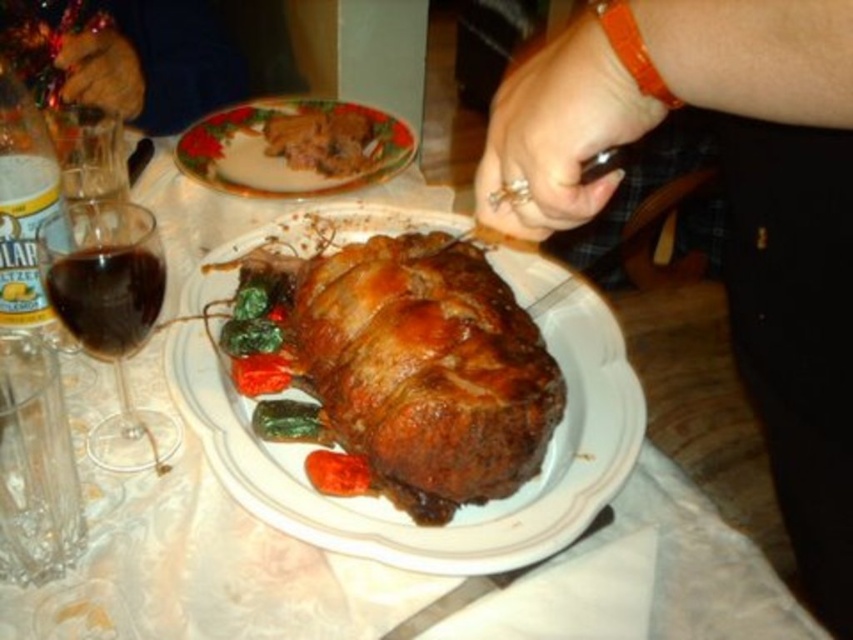
You are a guest at a dinner table and want to reach for the transparent glass at left without touching the smooth brown ham at center. Is this possible given their positions?

The smooth brown ham at center is positioned under the transparent glass at left, so you can reach for the transparent glass at left without touching the smooth brown ham at center as they are vertically aligned with the glass above the ham.

You are holding a ruler that is 12 inches long. You want to measure the distance between the camera and the point at coordinates point [624,68]. Will your ruler be long enough to measure this distance?

The distance between the camera and the point at coordinates point [624,68] is 11.86 inches, which is slightly shorter than the 12 inch ruler. Therefore, the ruler is long enough to measure the distance.

You are a chef arranging a plate for a photo shoot. You have a green leafy vegetable at center and a green glossy vegetable at center. Which vegetable should you place on top to make the arrangement look layered?

The green leafy vegetable at center is positioned over green glossy vegetable at center, so placing the green leafy vegetable at center on top would create a layered look.